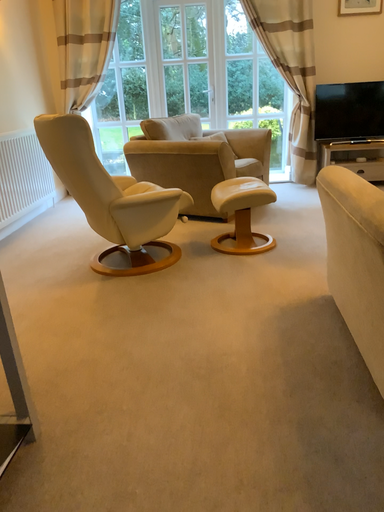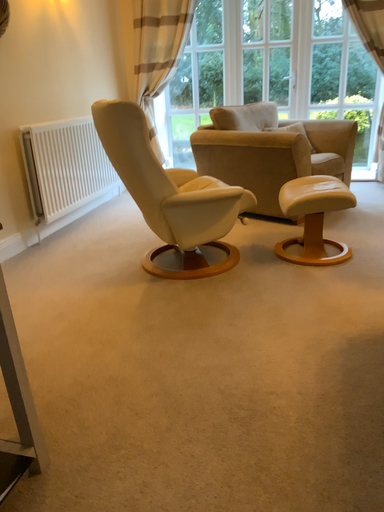
Question: How did the camera likely rotate when shooting the video?

Choices:
 (A) rotated right
 (B) rotated left

Answer: (B)